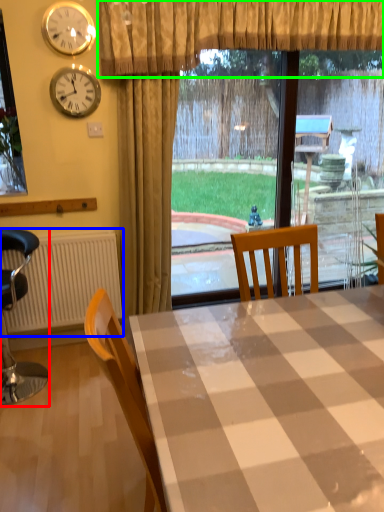
Question: Which object is positioned farthest from chair (highlighted by a red box)? Select from radiator (highlighted by a blue box) and curtain (highlighted by a green box).

Choices:
 (A) radiator
 (B) curtain

Answer: (B)